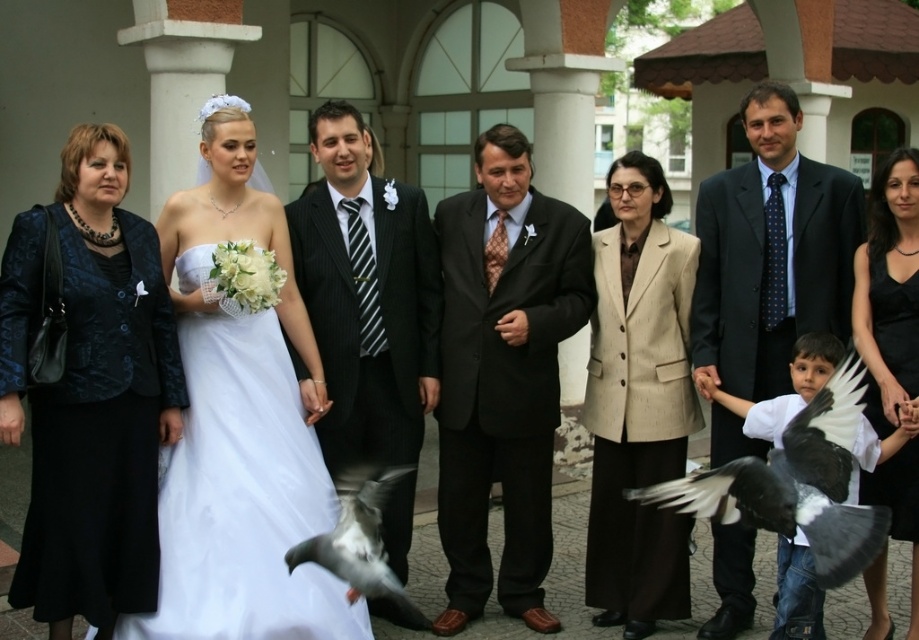
You are a photographer at the wedding and need to position a camera stand at point 0.5, 0.5 to capture the best angle. The white satin dress at center is currently at point 0.667, 0.262. Should you move the dress closer to the camera stand to align it better?

The white satin dress at center is at point (240, 426), which is to the right and slightly above the camera stand at (459, 320). Moving the dress closer to the center point would align it better with the camera stand.

You are a photographer positioned at the back of the venue. You want to capture a closeup shot of both the white satin dress at center and the dark blue suit at center in the same frame. The camera you are using has a maximum focus range of 15 feet. Can you take the photo without moving closer?

The white satin dress at center is 14.64 feet away from the dark blue suit at center. Since the maximum focus range of the camera is 15 feet, the distance between them is within the range. Therefore, you can take the photo without moving closer.